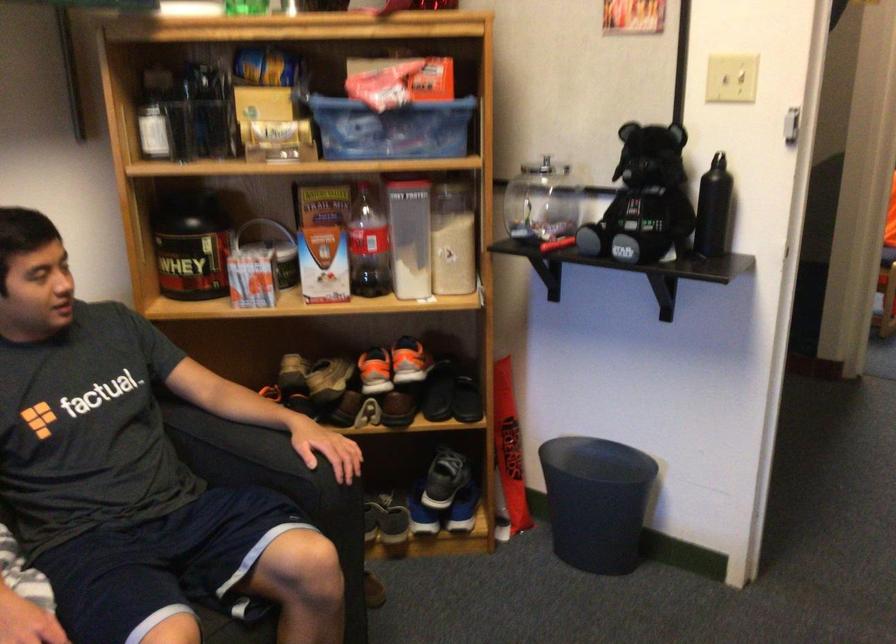
The height and width of the screenshot is (644, 896). Describe the element at coordinates (730, 78) in the screenshot. I see `the light switch` at that location.